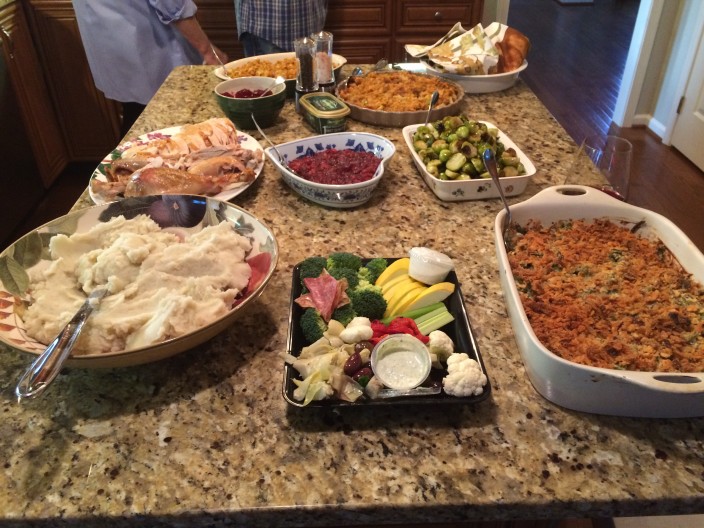
Locate an element on the screen. The width and height of the screenshot is (704, 528). spoon is located at coordinates (507, 224), (68, 332), (274, 145), (427, 118), (220, 61).